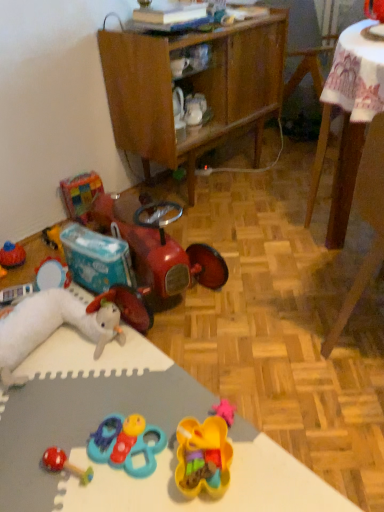
Where is `free space to the left of translucent plastic container at center, the fifth toy viewed from the left`? Image resolution: width=384 pixels, height=512 pixels. free space to the left of translucent plastic container at center, the fifth toy viewed from the left is located at coordinates (139, 475).